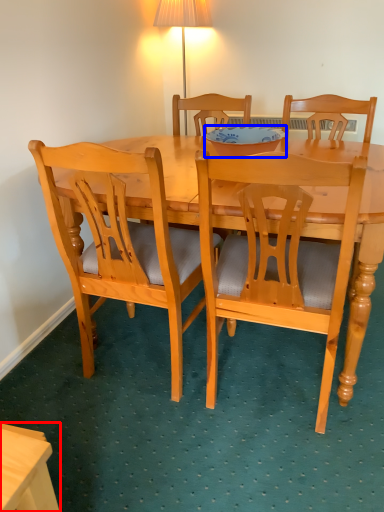
Question: Among these objects, which one is nearest to the camera, desk (highlighted by a red box) or bowl (highlighted by a blue box)?

Choices:
 (A) desk
 (B) bowl

Answer: (A)